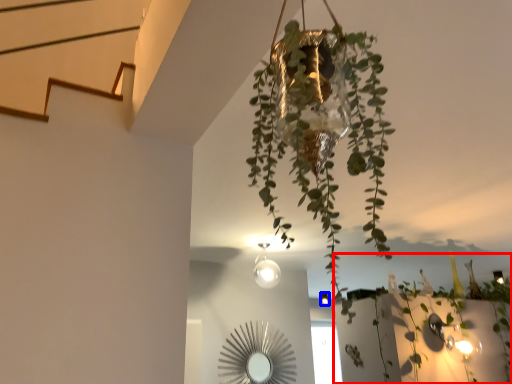
Question: Which object is further to the camera taking this photo, plant (highlighted by a red box) or light fixture (highlighted by a blue box)?

Choices:
 (A) plant
 (B) light fixture

Answer: (B)